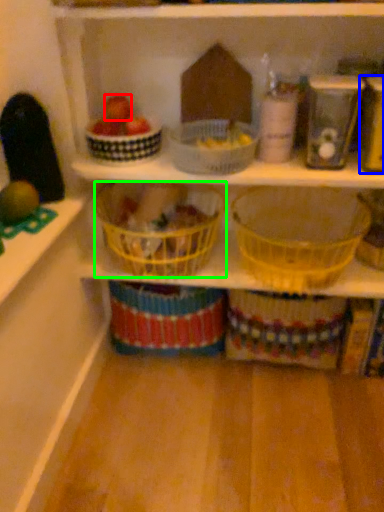
Question: Which object is the farthest from apple (highlighted by a red box)? Choose among these: appliance (highlighted by a blue box) or basket (highlighted by a green box).

Choices:
 (A) appliance
 (B) basket

Answer: (A)